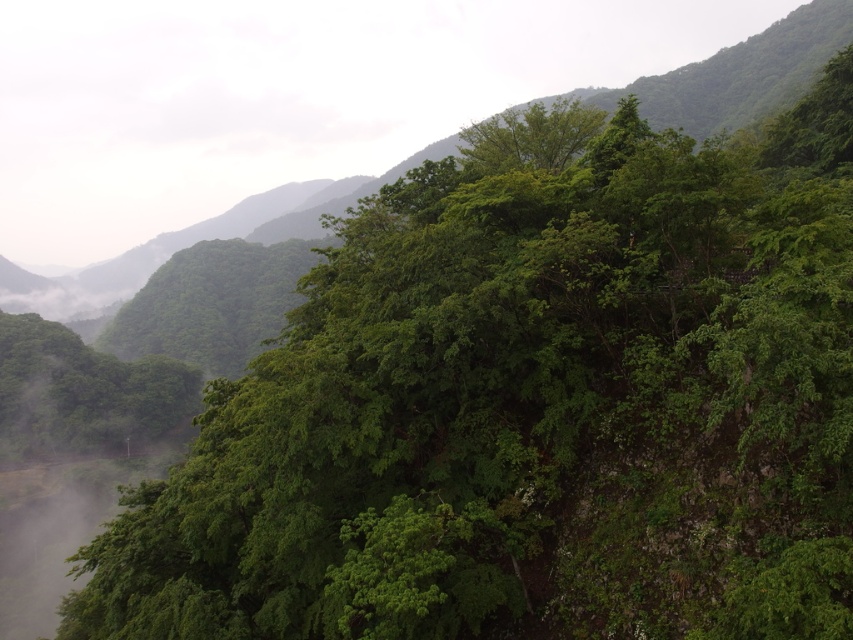
Based on the scene description, which object is larger in size between the green leafy mountain at center and the green leafy tree at upper center?

The green leafy mountain at center is bigger than the green leafy tree at upper center according to the description.

You are a hiker standing at the base of the green leafy mountain at center and looking towards the green leafy tree at upper center. Which object is closer to you?

The green leafy mountain at center is closer to you than the green leafy tree at upper center because the tree is positioned behind the mountain.